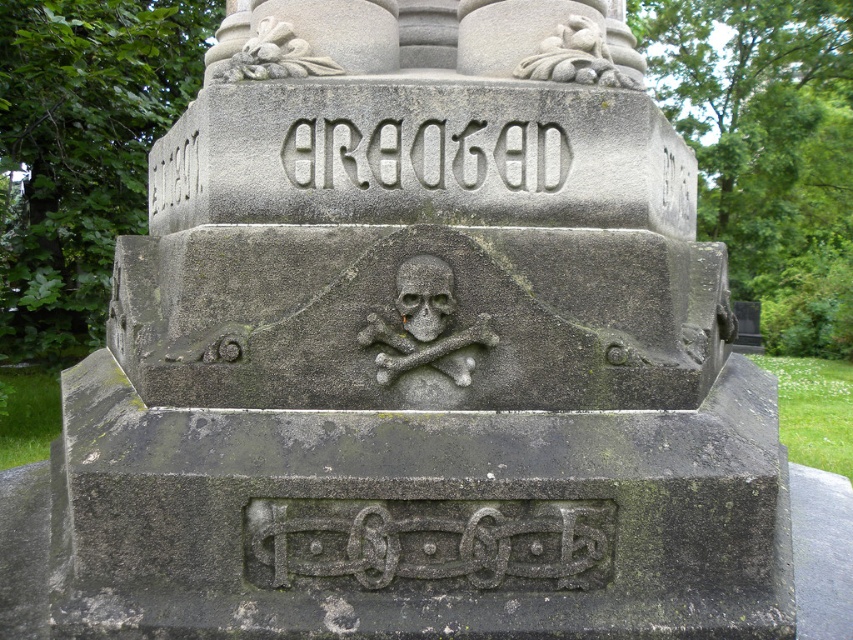
Question: Considering the real-world distances, which object is closest to the carved stone skull and crossbones at center?

Choices:
 (A) white stone lettering at center
 (B) carved stone ornament at upper center
 (C) smooth stone grapes at upper center

Answer: (A)

Question: Which point appears closest to the camera in this image?

Choices:
 (A) (486, 170)
 (B) (322, 68)

Answer: (A)

Question: Is smooth stone grapes at upper center bigger than carved stone ornament at upper center?

Choices:
 (A) no
 (B) yes

Answer: (A)

Question: Which object is farther from the camera taking this photo?

Choices:
 (A) white stone lettering at center
 (B) carved stone ornament at upper center
 (C) carved stone skull and crossbones at center
 (D) smooth stone grapes at upper center

Answer: (D)

Question: Is white stone lettering at center closer to the viewer compared to smooth stone grapes at upper center?

Choices:
 (A) yes
 (B) no

Answer: (A)

Question: Is white stone lettering at center to the right of carved stone skull and crossbones at center from the viewer's perspective?

Choices:
 (A) yes
 (B) no

Answer: (B)